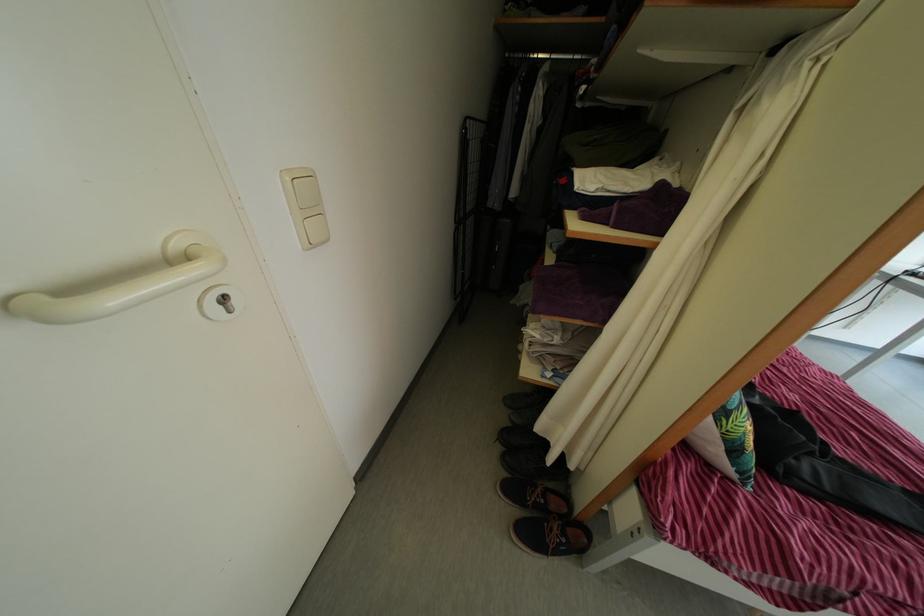
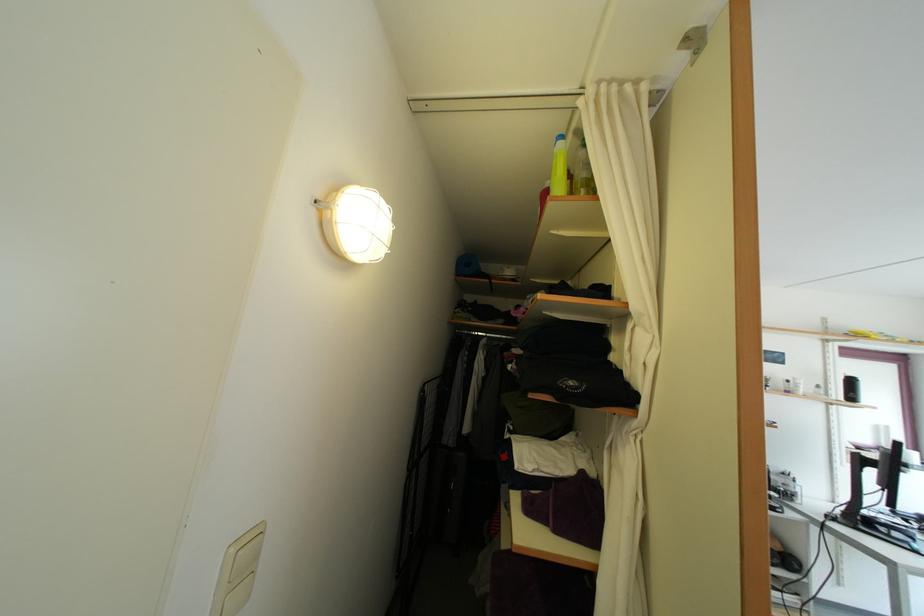
Question: I am providing you with two images of the same scene from different viewpoints. After the viewpoint changes to image2, which objects are now occluded?

Choices:
 (A) yellow spray bottle
 (B) blue rolled-up mat
 (C) white curtain
 (D) none of these

Answer: (D)